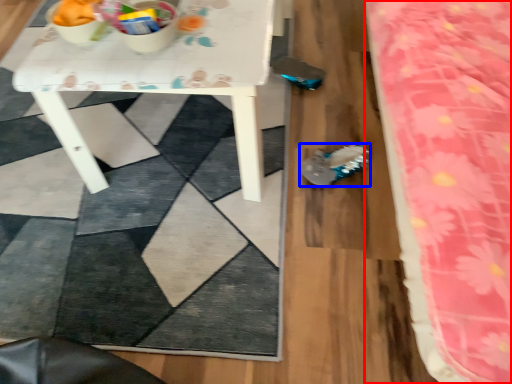
Question: Which point is further to the camera, bed (highlighted by a red box) or footwear (highlighted by a blue box)?

Choices:
 (A) bed
 (B) footwear

Answer: (B)